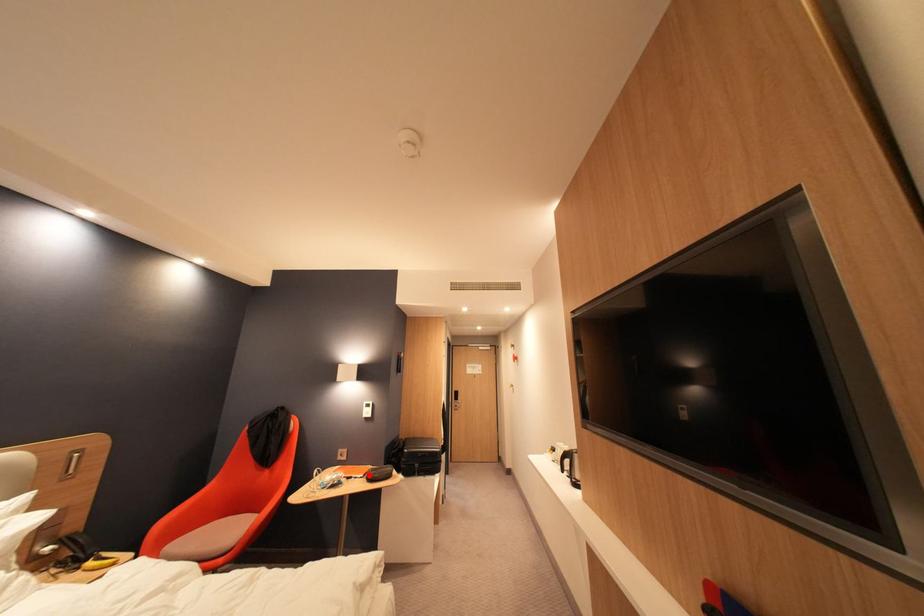
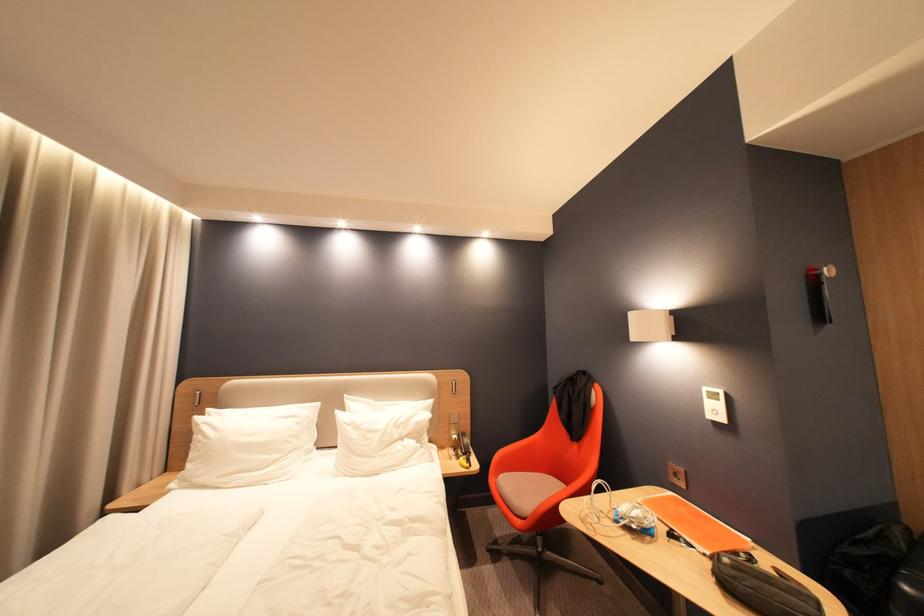
Locate, in the second image, the point that corresponds to the highlighted location in the first image.

(710, 544)